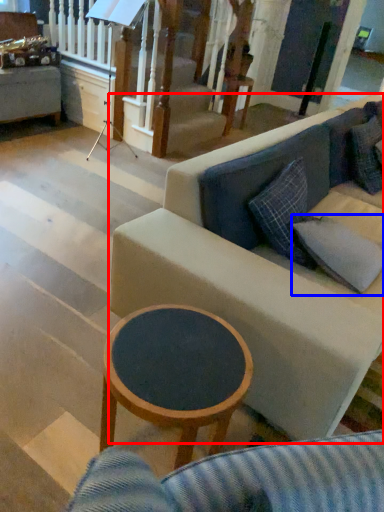
Question: Which object appears closest to the camera in this image, studio couch (highlighted by a red box) or pillow (highlighted by a blue box)?

Choices:
 (A) studio couch
 (B) pillow

Answer: (A)